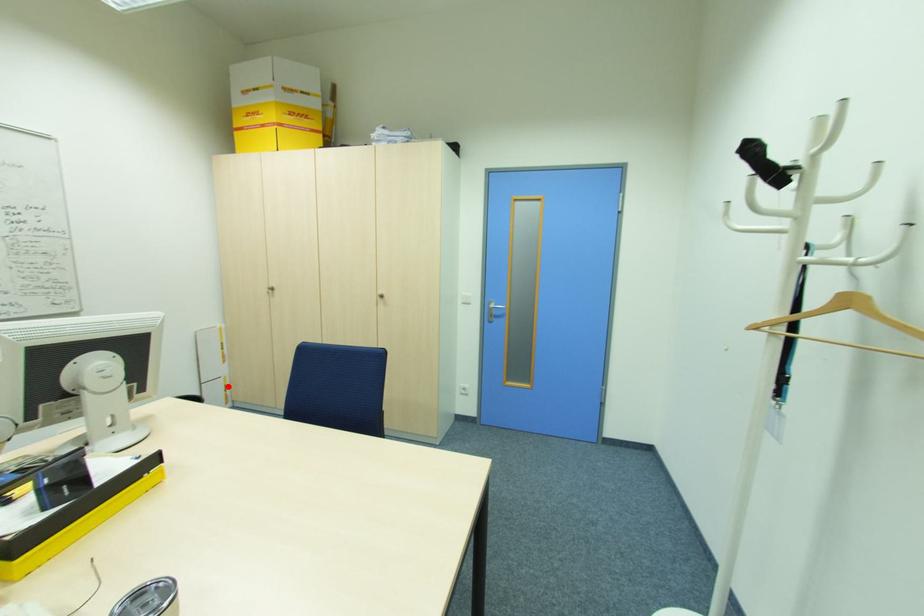
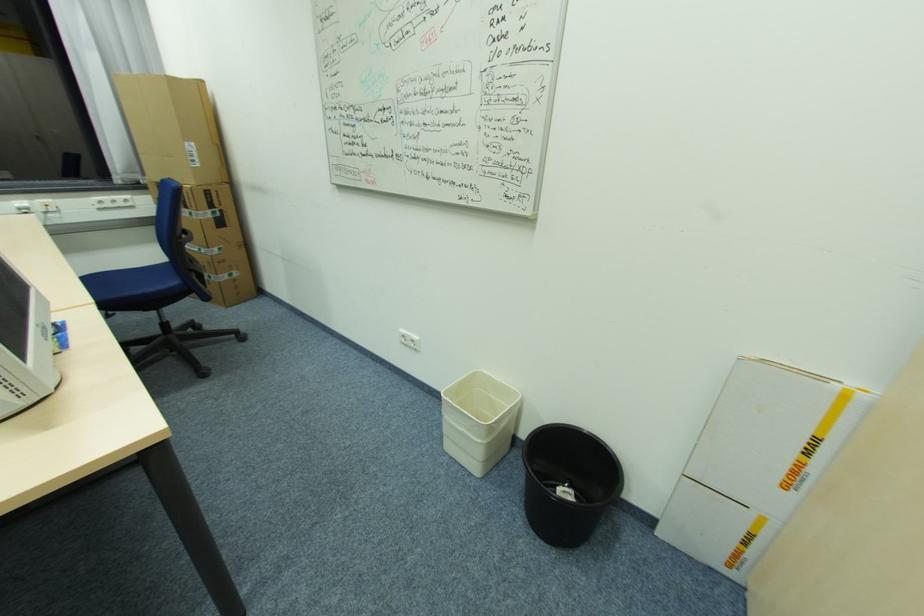
Question: I am providing you with two images of the same scene from different viewpoints. In image1, a red point is highlighted. Considering the same 3D point in image2, which of the following is correct?

Choices:
 (A) It is closer
 (B) It is farther

Answer: (A)